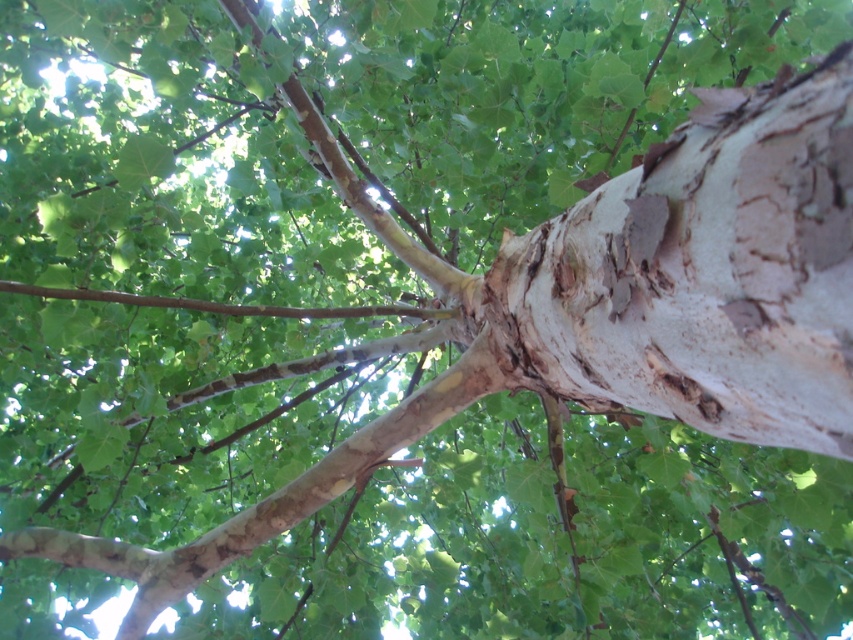
You are a botanist examining the tree trunk. You notice the white rough bark at center and the brown rough branch at center. Which of these two is positioned to the right of the other?

The white rough bark at center is to the right of the brown rough branch at center.

You are standing directly in front of the tree trunk and want to touch the white rough bark at center. Based on its position, where should you aim your hand relative to the base of the trunk?

The white rough bark at center is located at point (704, 273), which means it is positioned approximately 42.8 percent from the left edge and 82.6 percent from the bottom edge of the image. To reach it, aim your hand towards the upper middle section of the trunk, slightly to the right of center and closer to the top.